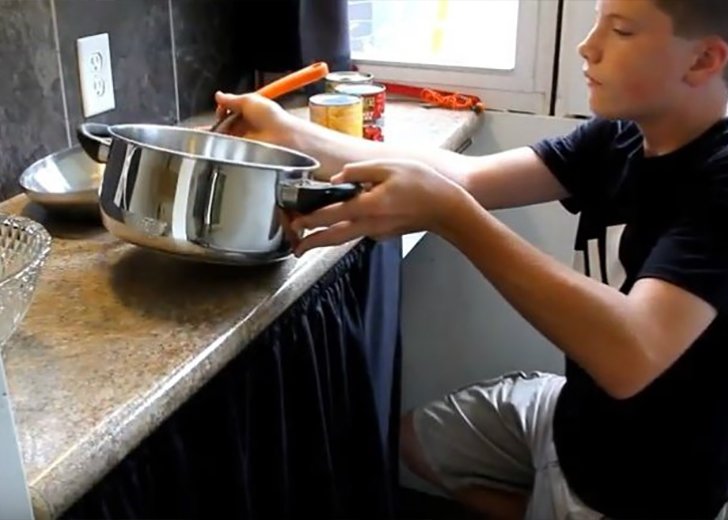
I want to click on black marble tile, so click(135, 48), click(191, 30), click(14, 109).